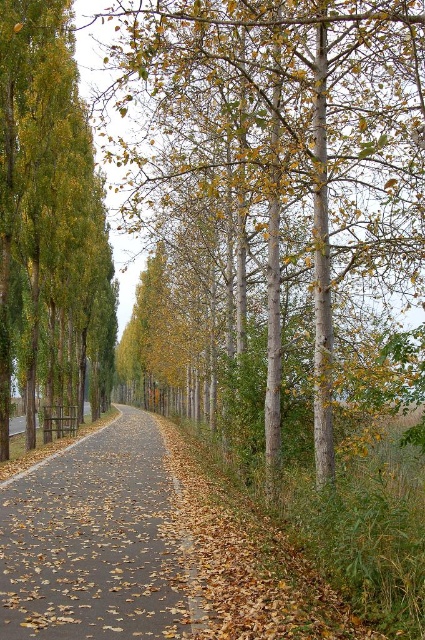
Question: Is smooth gray tree at center bigger than brown asphalt path at center?

Choices:
 (A) yes
 (B) no

Answer: (A)

Question: Which object is the farthest from the brown asphalt path at center?

Choices:
 (A) smooth gray tree at center
 (B) green glossy tree at left

Answer: (B)

Question: Among these points, which one is nearest to the camera?

Choices:
 (A) (8, 392)
 (B) (353, 109)
 (C) (85, 570)

Answer: (C)

Question: Does smooth gray tree at center come in front of brown asphalt path at center?

Choices:
 (A) no
 (B) yes

Answer: (A)

Question: Which object appears closest to the camera in this image?

Choices:
 (A) brown asphalt path at center
 (B) green glossy tree at left

Answer: (A)

Question: Is green glossy tree at left wider than brown asphalt path at center?

Choices:
 (A) no
 (B) yes

Answer: (B)